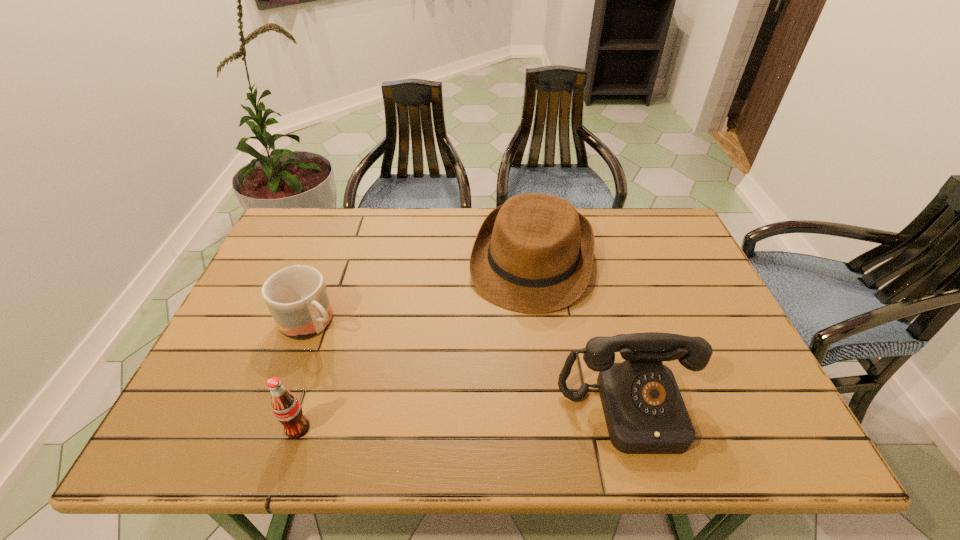
In the image, there is a desktop. What are the coordinates of `vacant space at the far left corner` in the screenshot? It's located at (315, 232).

This screenshot has height=540, width=960. Identify the location of unoccupied position between the soda and the fedora. point(415,345).

Where is `unoccupied position between the fedora and the mug`? This screenshot has height=540, width=960. unoccupied position between the fedora and the mug is located at coordinates (421, 292).

Identify the location of blank region between the mug and the fedora. The image size is (960, 540). pyautogui.click(x=421, y=292).

Where is `empty location between the fedora and the soda`? The image size is (960, 540). empty location between the fedora and the soda is located at coordinates tap(415, 345).

The image size is (960, 540). I want to click on blank region between the soda and the mug, so click(304, 375).

The image size is (960, 540). What are the coordinates of `vacant area between the fedora and the soda` in the screenshot? It's located at (415, 345).

At what (x,y) coordinates should I click in order to perform the action: click on vacant area that lies between the soda and the mug. Please return your answer as a coordinate pair (x, y). Looking at the image, I should click on (304, 375).

What are the coordinates of `free spot between the telephone and the fedora` in the screenshot? It's located at (581, 336).

Identify the location of empty location between the mug and the soda. The height and width of the screenshot is (540, 960). (304, 375).